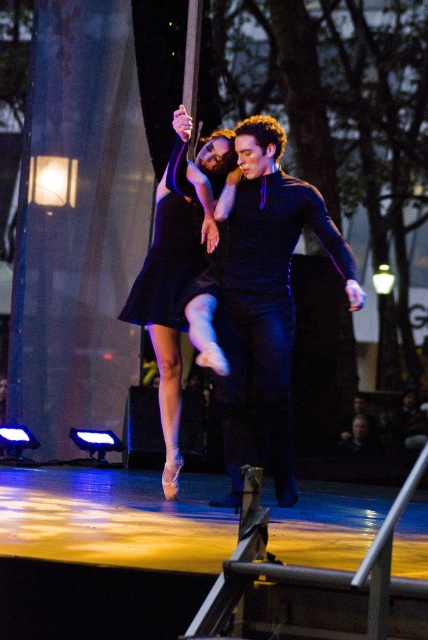
Is dark blue sweater at center positioned at the back of matte black dress at center?

Yes, dark blue sweater at center is further from the viewer.

Who is positioned more to the left, dark blue sweater at center or matte black dress at center?

From the viewer's perspective, matte black dress at center appears more on the left side.

The width and height of the screenshot is (428, 640). What do you see at coordinates (264, 304) in the screenshot?
I see `dark blue sweater at center` at bounding box center [264, 304].

You are a GUI agent. You are given a task and a screenshot of the screen. Output one action in this format:
    pyautogui.click(x=<x>, y=<y>)
    Task: Click on the dark blue sweater at center
    
    Given the screenshot: What is the action you would take?
    [x=264, y=304]

In the scene shown: Can you confirm if matte black dress at center is positioned to the left of black satin dress at center?

Yes, matte black dress at center is to the left of black satin dress at center.

Who is taller, matte black dress at center or black satin dress at center?

matte black dress at center is taller.

The image size is (428, 640). Identify the location of matte black dress at center. (181, 280).

Does point (229, 460) lie in front of point (181, 193)?

Yes, point (229, 460) is in front of point (181, 193).

Does dark blue sweater at center appear over black satin dress at center?

Actually, dark blue sweater at center is below black satin dress at center.

What are the coordinates of `dark blue sweater at center` in the screenshot? It's located at (264, 304).